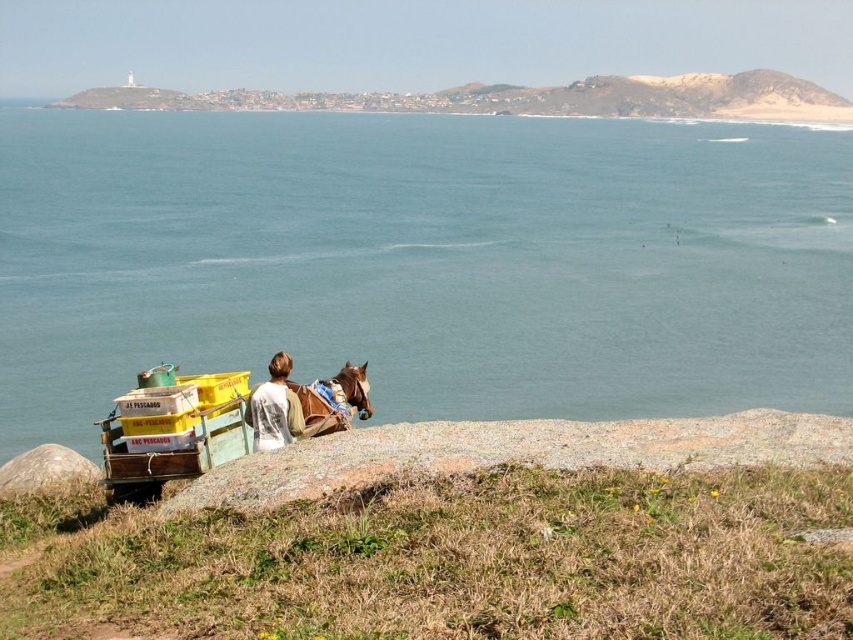
You are a drone operator trying to capture a photo of the scene. The drone is currently at the position of the blue water at center. You need to adjust the drone to the exact center of the image, which is at point coordinates of 0.5, 0.5. In which direction should you move the drone to reach the exact center?

The blue water at center is at point coordinates of (424, 262). To reach the exact center at (426, 320), you should move the drone slightly to the right and upward since the current x coordinate is lower than 0.5 and the y coordinate is also slightly lower than 0.5.

You are a photographer standing at the base of the smooth sand dunes at upper center. You want to take a photo of the yellow plastic wagon at lower left. Can you see the wagon without moving your position?

The yellow plastic wagon at lower left is behind the smooth sand dunes at upper center, so it is obstructed from your current position. You cannot see the wagon without moving.

From the picture: You are standing at the point closer to the camera in the scene. Which point are you at, point (601,80) or point (282,403)?

You are at point (282,403) because it is closer to the viewer compared to point (601,80), which is further away.